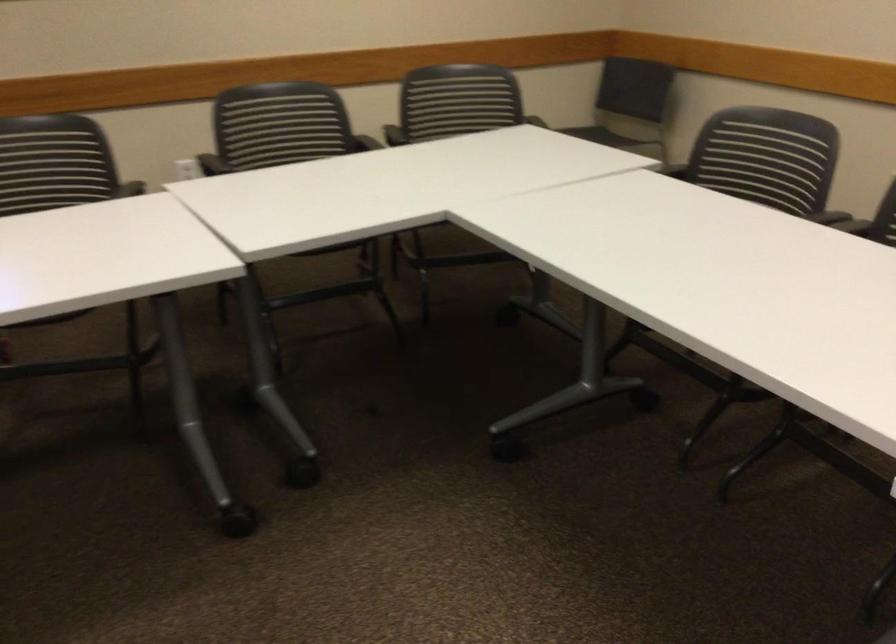
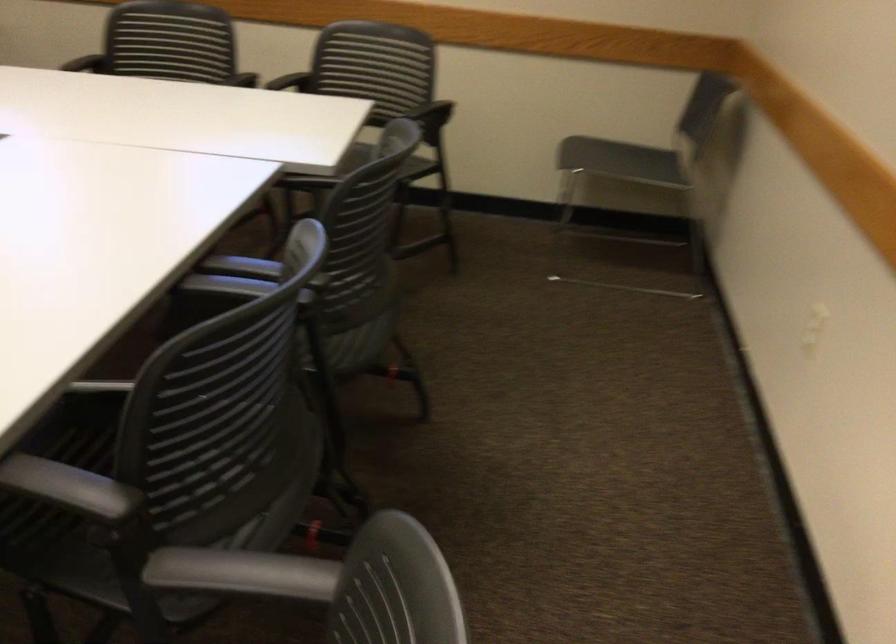
In the second image, find the point that corresponds to (x=791, y=230) in the first image.

(246, 274)